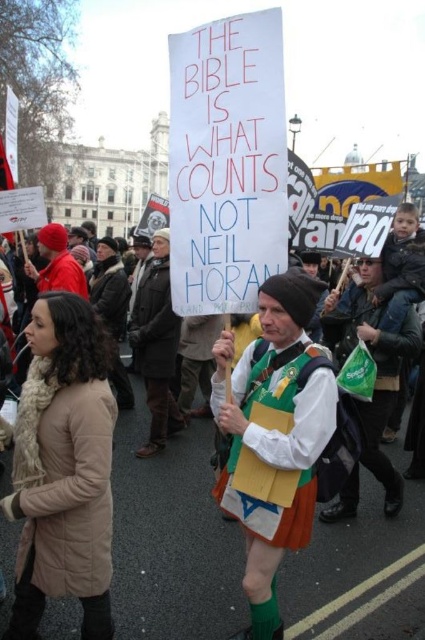
You are a photographer trying to capture the scene of the demonstration. You notice the white paper sign at center and the brown leather jacket at center. Which object should you zoom in on to ensure both fit in the frame without cropping? Explain your reasoning based on their sizes.

The white paper sign at center is wider than the brown leather jacket at center. To ensure both fit in the frame without cropping, you should zoom in on the white paper sign at center since it is the wider object and accommodating its width will naturally include the narrower brown leather jacket at center within the frame.

You are a photographer trying to capture the man in the scene. You notice the green fabric scarf at center and the brown leather jacket at center. Which item is closer to the camera lens when focusing on the man?

The green fabric scarf at center is positioned under the brown leather jacket at center, so the brown leather jacket at center is closer to the camera lens.